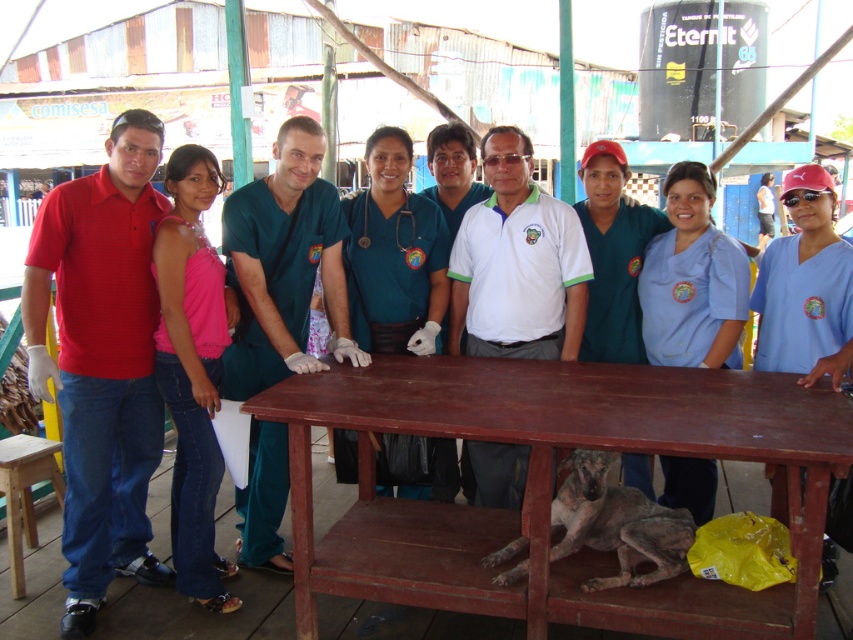
Question: Based on their relative distances, which object is nearer to the brown wooden table at center?

Choices:
 (A) light blue scrubs at center
 (B) pink fabric top at left
 (C) light brown wooden stool at lower left

Answer: (A)

Question: Is brown wooden table at center wider than light blue scrubs at center?

Choices:
 (A) yes
 (B) no

Answer: (A)

Question: Is brown wooden table at center below pink fabric top at left?

Choices:
 (A) yes
 (B) no

Answer: (A)

Question: Which of the following is the closest to the observer?

Choices:
 (A) [x=666, y=253]
 (B) [x=779, y=412]

Answer: (B)

Question: Is light blue scrubs at center closer to camera compared to light brown wooden stool at lower left?

Choices:
 (A) no
 (B) yes

Answer: (A)

Question: Which point is farther to the camera?

Choices:
 (A) pink fabric top at left
 (B) brown wooden table at center
 (C) light brown wooden stool at lower left

Answer: (C)